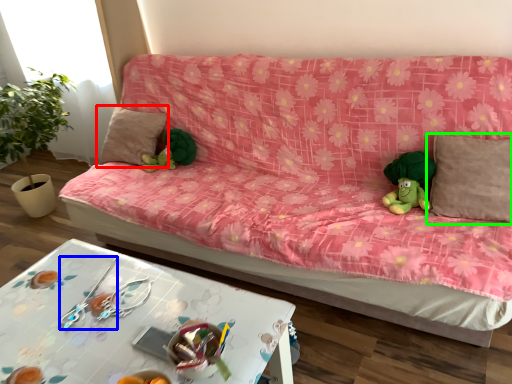
Question: Which object is positioned farthest from pillow (highlighted by a red box)? Select from twin (highlighted by a blue box) and pillow (highlighted by a green box).

Choices:
 (A) twin
 (B) pillow

Answer: (B)